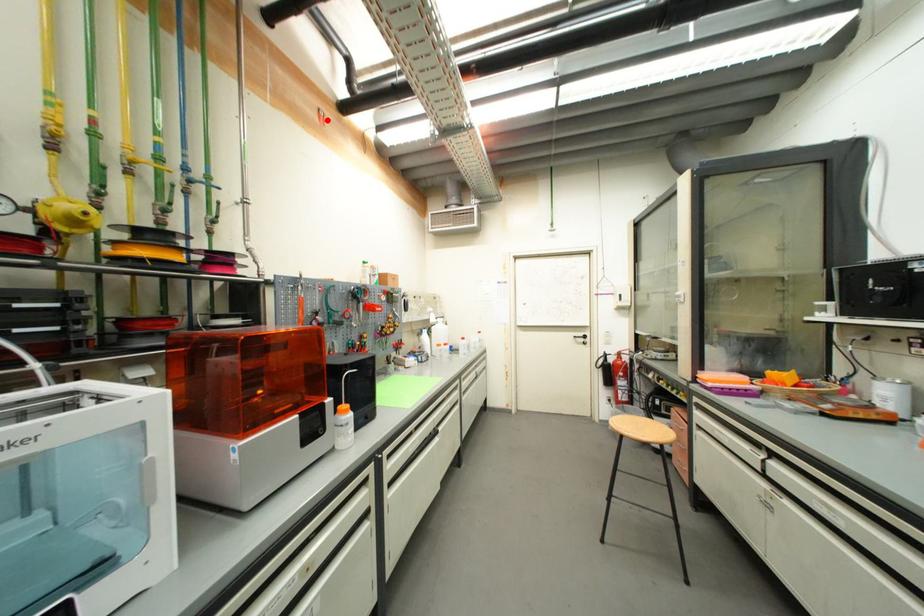
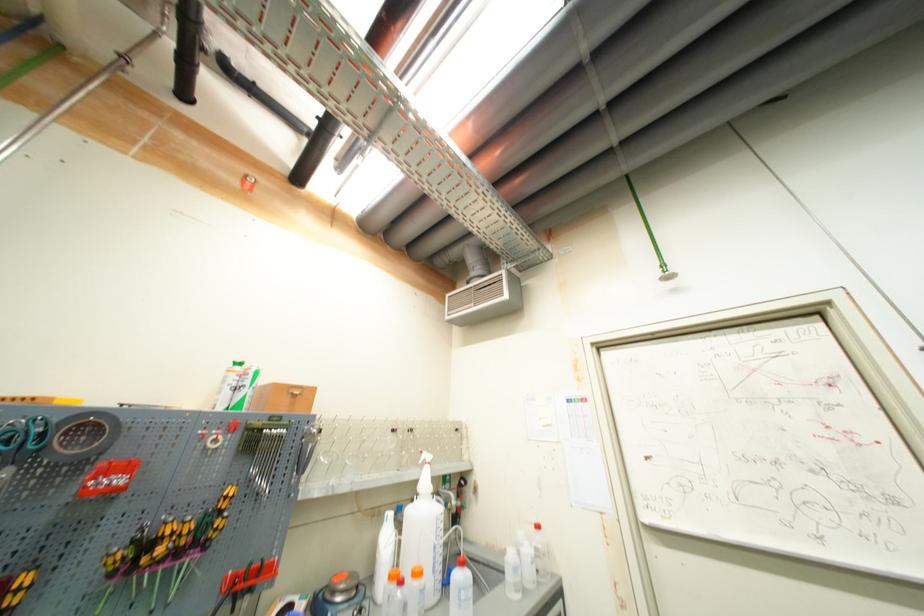
In the second image, find the point that corresponds to the highlighted location in the first image.

(253, 185)